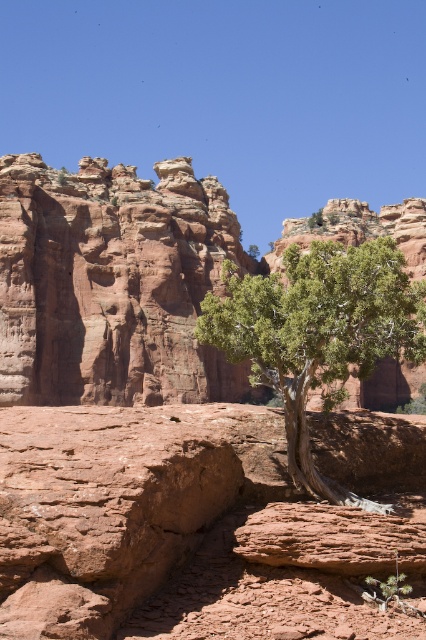
Can you confirm if rustic sandstone rock formation at center is positioned below green leafy tree at center?

Incorrect, rustic sandstone rock formation at center is not positioned below green leafy tree at center.

Is rustic sandstone rock formation at center to the right of green leafy tree at center from the viewer's perspective?

Incorrect, rustic sandstone rock formation at center is not on the right side of green leafy tree at center.

Is point (137, 307) positioned before point (310, 342)?

No, it is not.

The height and width of the screenshot is (640, 426). What are the coordinates of `rustic sandstone rock formation at center` in the screenshot? It's located at (112, 284).